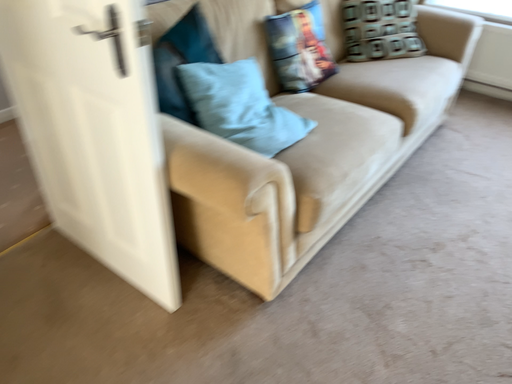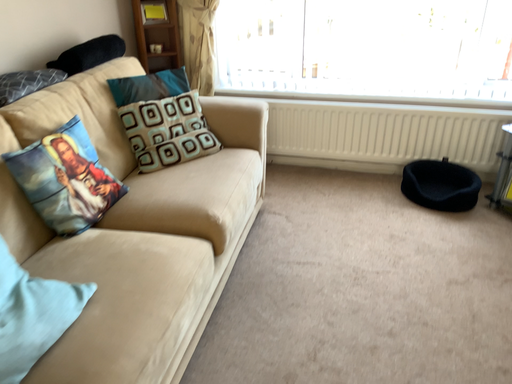
Question: How did the camera likely rotate when shooting the video?

Choices:
 (A) rotated downward
 (B) rotated upward

Answer: (B)